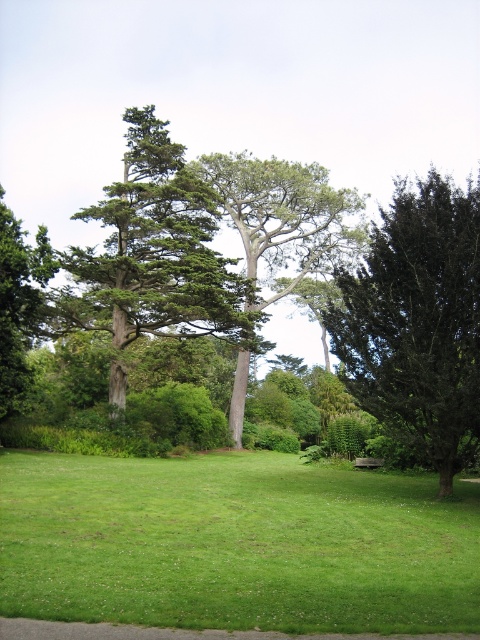
Question: Is dark green textured tree at right smaller than green textured tree at center?

Choices:
 (A) yes
 (B) no

Answer: (A)

Question: Where is green leafy tree at center located in relation to green matte tree at left in the image?

Choices:
 (A) above
 (B) below

Answer: (A)

Question: Which of these objects is positioned closest to the green grass at center?

Choices:
 (A) green leafy tree at center
 (B) dark green textured tree at right
 (C) green textured tree at center
 (D) green matte tree at left

Answer: (B)

Question: Which of the following is the closest to the observer?

Choices:
 (A) green textured tree at center
 (B) green leafy tree at center
 (C) dark green textured tree at right
 (D) green matte tree at left

Answer: (C)

Question: Which object is the farthest from the green matte tree at left?

Choices:
 (A) green leafy tree at center
 (B) green textured tree at center
 (C) green grass at center
 (D) dark green textured tree at right

Answer: (A)

Question: Is the position of green grass at center less distant than that of green matte tree at left?

Choices:
 (A) yes
 (B) no

Answer: (A)